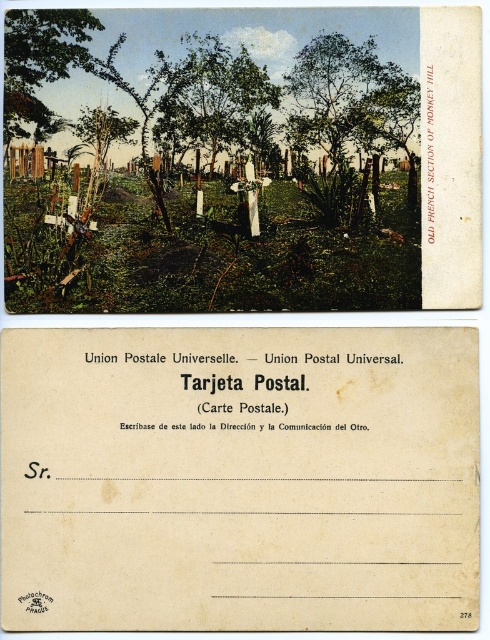
Does green leafy tree at upper center have a larger size compared to green leafy tree at center?

Yes, green leafy tree at upper center is bigger than green leafy tree at center.

Does green leafy tree at upper center have a lesser height compared to green leafy tree at center?

No.

Describe the element at coordinates (350, 99) in the screenshot. I see `green leafy tree at upper center` at that location.

Find the location of a particular element. green leafy tree at upper center is located at coordinates (350, 99).

Can you confirm if green leafy tree at upper center is taller than green leafy tree at upper left?

Correct, green leafy tree at upper center is much taller as green leafy tree at upper left.

Does point (406, 99) lie in front of point (37, 122)?

Yes, point (406, 99) is in front of point (37, 122).

Where is `green leafy tree at upper center`? green leafy tree at upper center is located at coordinates (x=350, y=99).

Describe the element at coordinates (240, 480) in the screenshot. This screenshot has height=640, width=490. I see `off-white paper at center` at that location.

What are the coordinates of `off-white paper at center` in the screenshot? It's located at (240, 480).